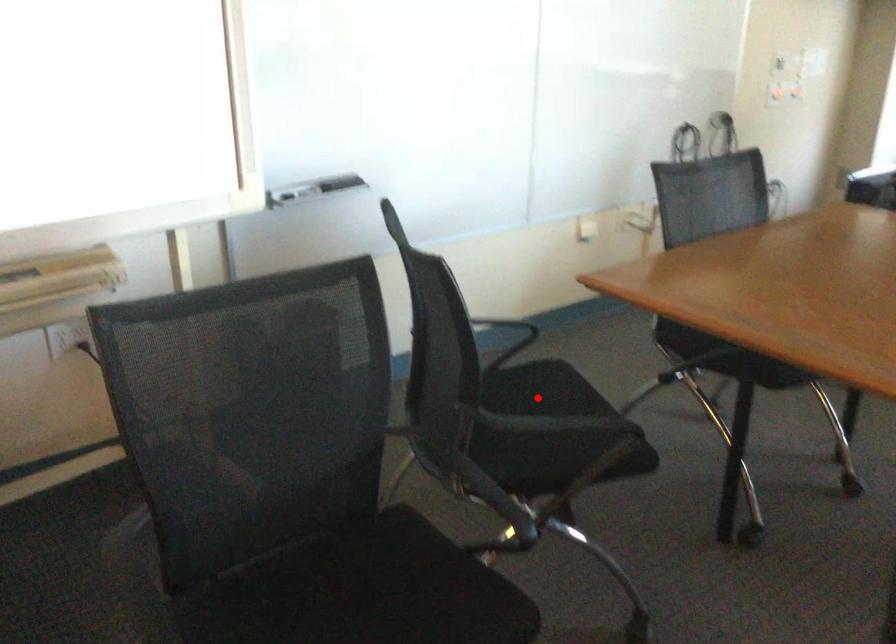
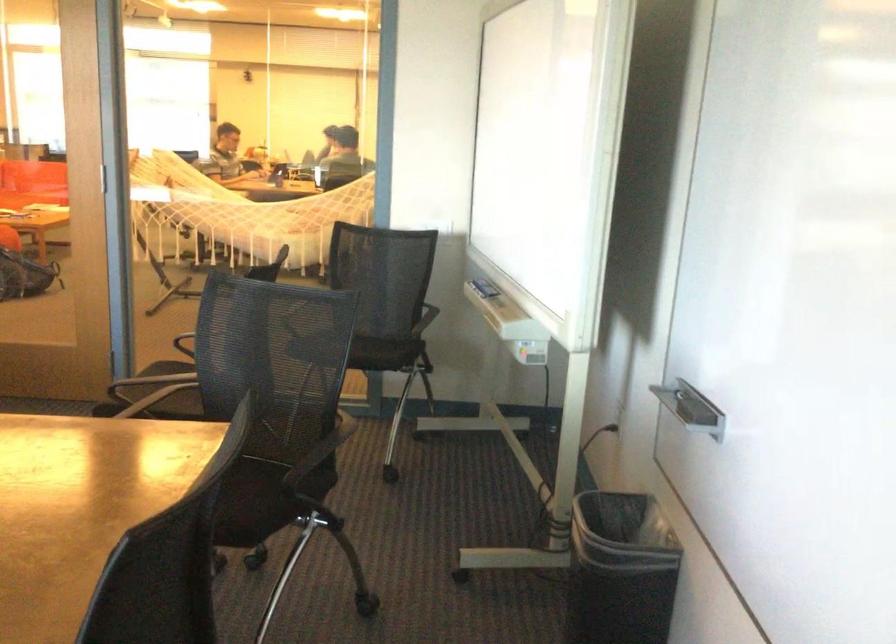
Where in the second image is the point corresponding to the highlighted location from the first image?

(243, 494)